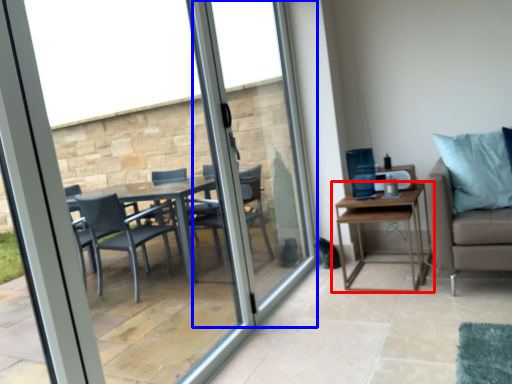
Question: Which point is further to the camera, table (highlighted by a red box) or screen door (highlighted by a blue box)?

Choices:
 (A) table
 (B) screen door

Answer: (A)